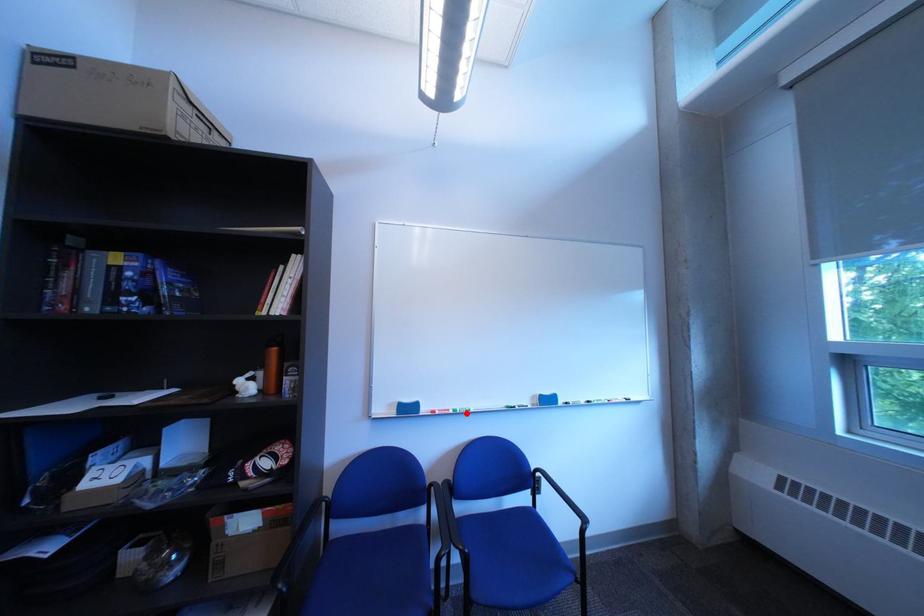
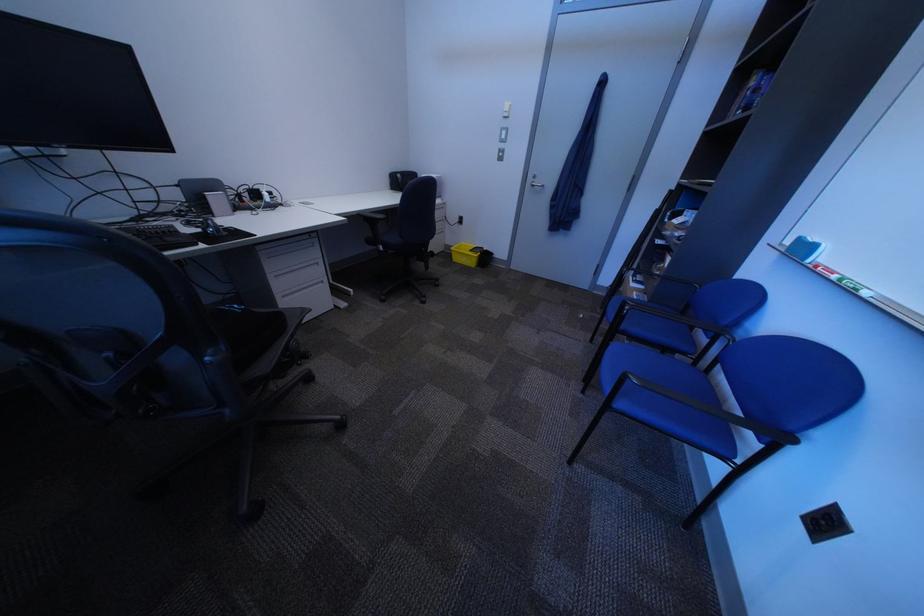
The point at the highlighted location is marked in the first image. Where is the corresponding point in the second image?

(849, 278)